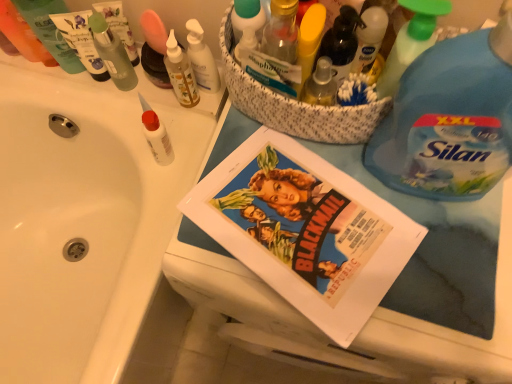
This screenshot has width=512, height=384. What are the coordinates of `free location in front of white matte glue at upper left, the fifth toiletry from the left` in the screenshot? It's located at coord(156,218).